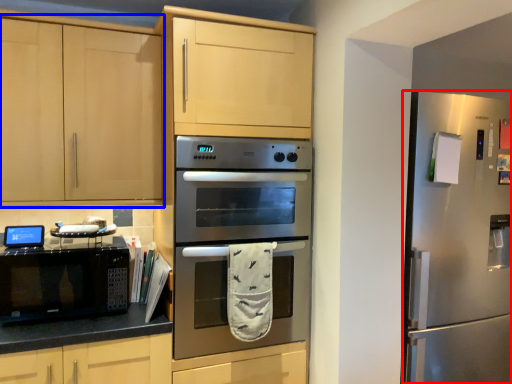
Question: Which object appears farthest to the camera in this image, refrigerator (highlighted by a red box) or cabinetry (highlighted by a blue box)?

Choices:
 (A) refrigerator
 (B) cabinetry

Answer: (A)